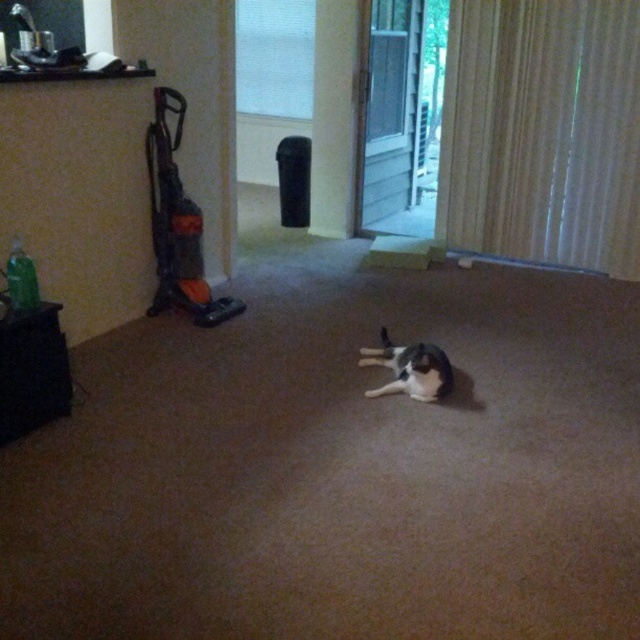
Question: Which object is positioned closest to the orange plastic vacuum at left?

Choices:
 (A) transparent glass screen door at center
 (B) gray and white fur cat at center

Answer: (B)

Question: Does transparent glass screen door at center appear over orange plastic vacuum at left?

Choices:
 (A) yes
 (B) no

Answer: (A)

Question: Can you confirm if transparent glass screen door at center is positioned to the right of gray and white fur cat at center?

Choices:
 (A) no
 (B) yes

Answer: (B)

Question: Based on their relative distances, which object is farther from the gray and white fur cat at center?

Choices:
 (A) orange plastic vacuum at left
 (B) transparent glass screen door at center

Answer: (B)

Question: Considering the relative positions of transparent glass screen door at center and gray and white fur cat at center in the image provided, where is transparent glass screen door at center located with respect to gray and white fur cat at center?

Choices:
 (A) left
 (B) right

Answer: (B)

Question: Which object appears closest to the camera in this image?

Choices:
 (A) transparent glass screen door at center
 (B) orange plastic vacuum at left
 (C) gray and white fur cat at center

Answer: (C)